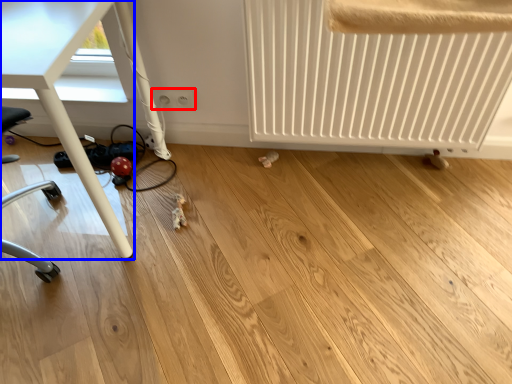
Question: Which of the following is the farthest to the observer, electric outlet (highlighted by a red box) or table (highlighted by a blue box)?

Choices:
 (A) electric outlet
 (B) table

Answer: (A)